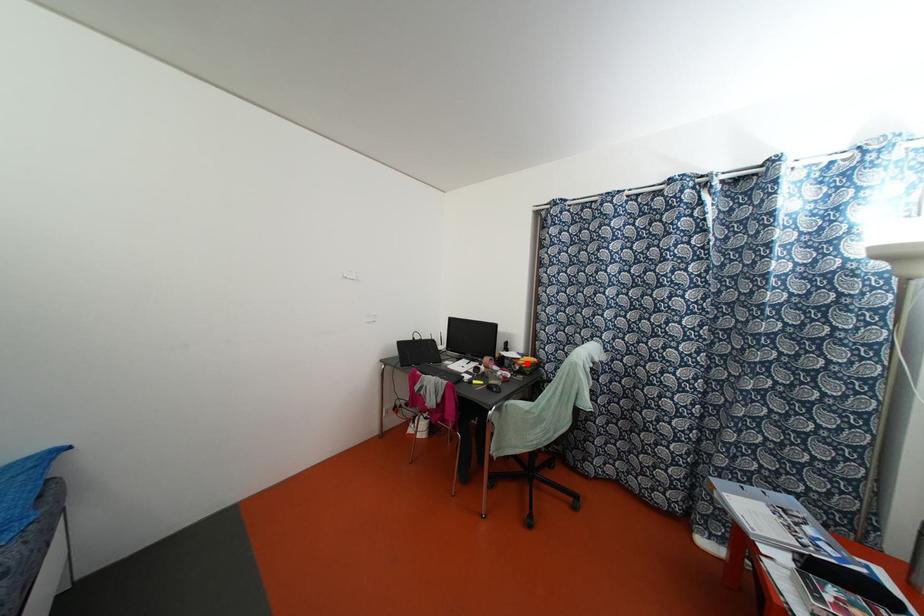
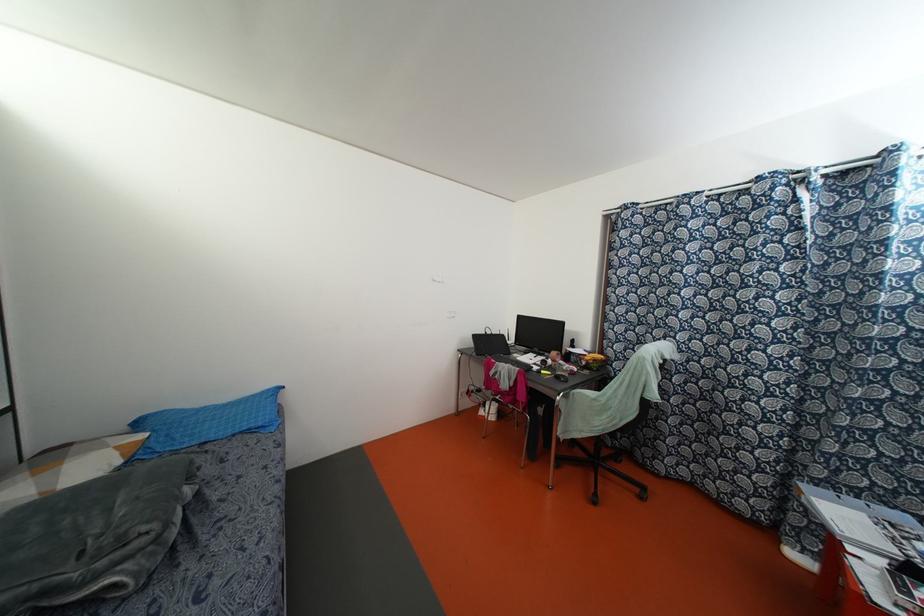
Question: I am providing you with two images of the same scene from different viewpoints. A red point is shown in image1. For the corresponding object point in image2, is it positioned nearer or farther from the camera?

Choices:
 (A) Nearer
 (B) Farther

Answer: (A)